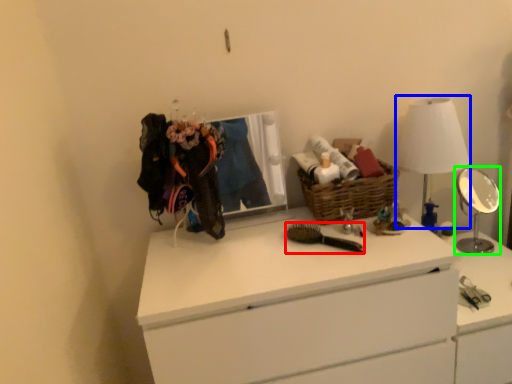
Question: Which object is positioned farthest from brush (highlighted by a red box)? Select from table lamp (highlighted by a blue box) and mirror (highlighted by a green box).

Choices:
 (A) table lamp
 (B) mirror

Answer: (B)